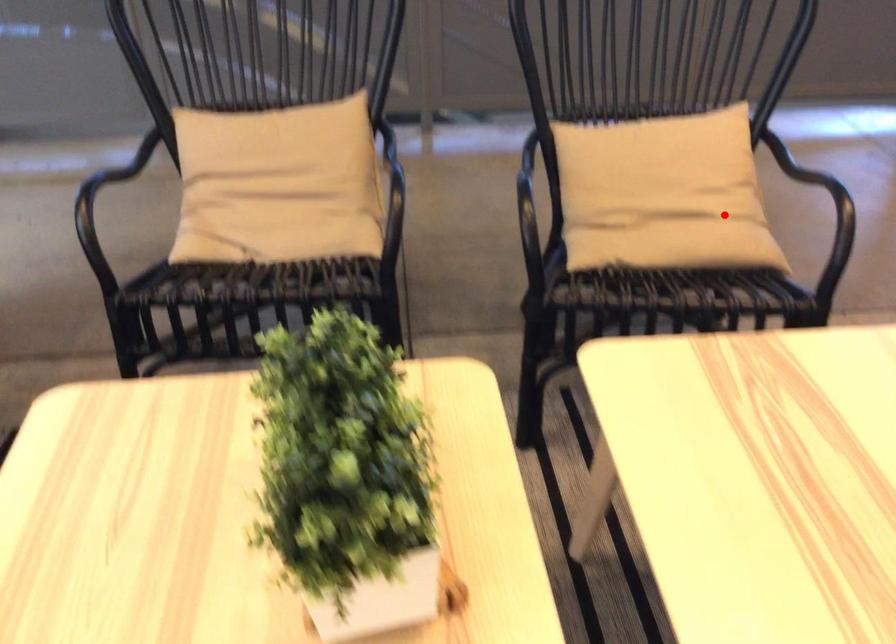
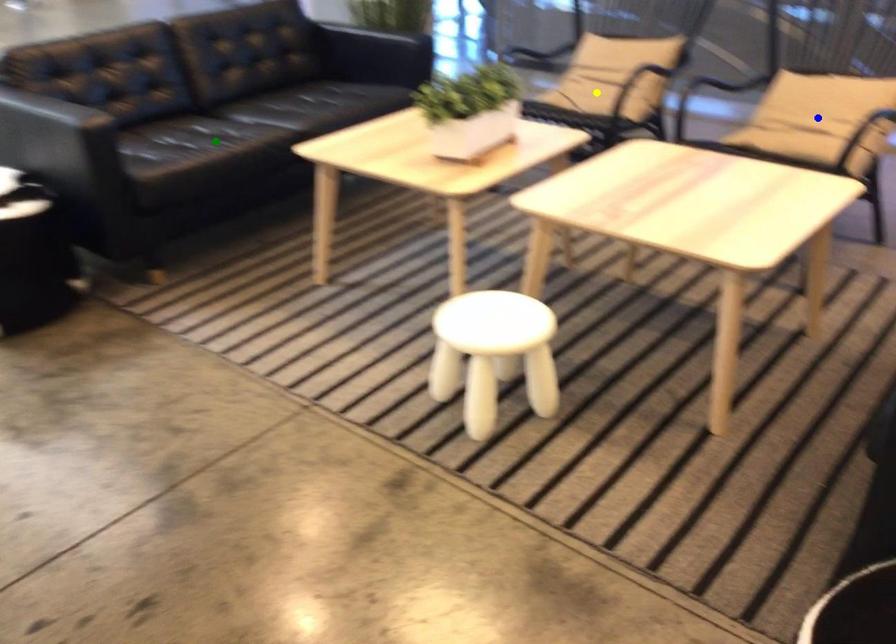
Question: I am providing you with two images of the same scene from different viewpoints. A red point is marked on the first image. You are given multiple points on the second image. Which mark in image 2 goes with the point in image 1?

Choices:
 (A) blue point
 (B) green point
 (C) yellow point

Answer: (A)